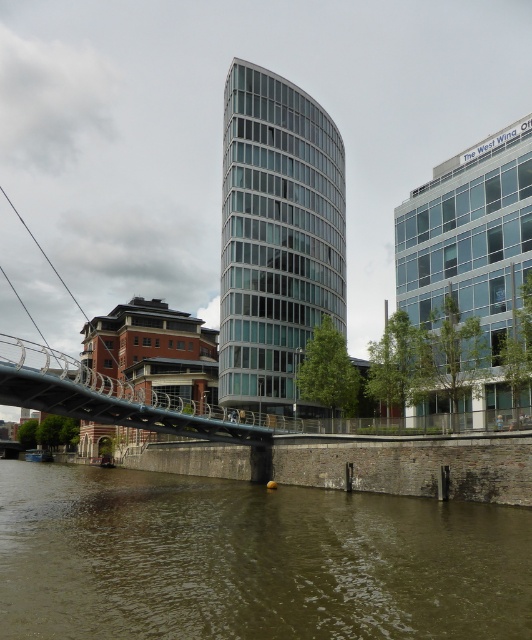
In the scene shown: You are standing at the pedestrian bridge and want to determine the relative positions of two points marked in the scene. Which of the two points, point (20, 516) or point (19, 365), is closer to you?

Point (20, 516) is closer to the viewer than point (19, 365).

You are a tourist standing on the metallic gray bridge at center and want to take a photo of the clear glass building at center. Which direction should you face to capture it in your shot?

The clear glass building at center is to the right of the metallic gray bridge at center, so you should face to the right to capture it in your shot.

In the scene shown: You are standing on the stone embankment along the riverbank and want to cross to the other side. The pedestrian bridge with a sleek curved design is your only option. However, you notice a point marked at coordinates (251,561) on the image, which corresponds to the brown concrete river at lower center. Can you safely walk across the pedestrian bridge to reach the other side without getting wet?

The point at coordinates (251,561) indicates the brown concrete river at lower center, meaning the river is located at the lower central part of the image. Since the pedestrian bridge spans across the water, you can safely walk across it to reach the other side without getting wet.